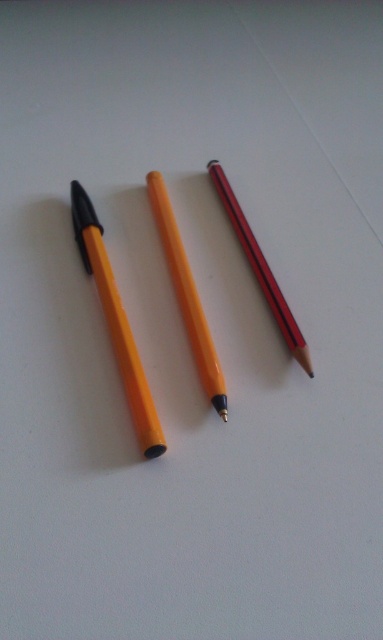
Question: Which point is farther to the camera?

Choices:
 (A) matte red pencil at center
 (B) matte orange pen at left
 (C) matte orange pencil at center

Answer: (A)

Question: Does matte orange pen at left have a lesser width compared to matte orange pencil at center?

Choices:
 (A) yes
 (B) no

Answer: (B)

Question: Which point is farther from the camera taking this photo?

Choices:
 (A) (256, 260)
 (B) (127, 394)
 (C) (209, 348)

Answer: (A)

Question: Which point is farther from the camera taking this photo?

Choices:
 (A) (147, 419)
 (B) (212, 353)

Answer: (B)

Question: In this image, where is matte orange pencil at center located relative to matte red pencil at center?

Choices:
 (A) below
 (B) above

Answer: (A)

Question: From the image, what is the correct spatial relationship of matte orange pen at left in relation to matte red pencil at center?

Choices:
 (A) below
 (B) above

Answer: (A)